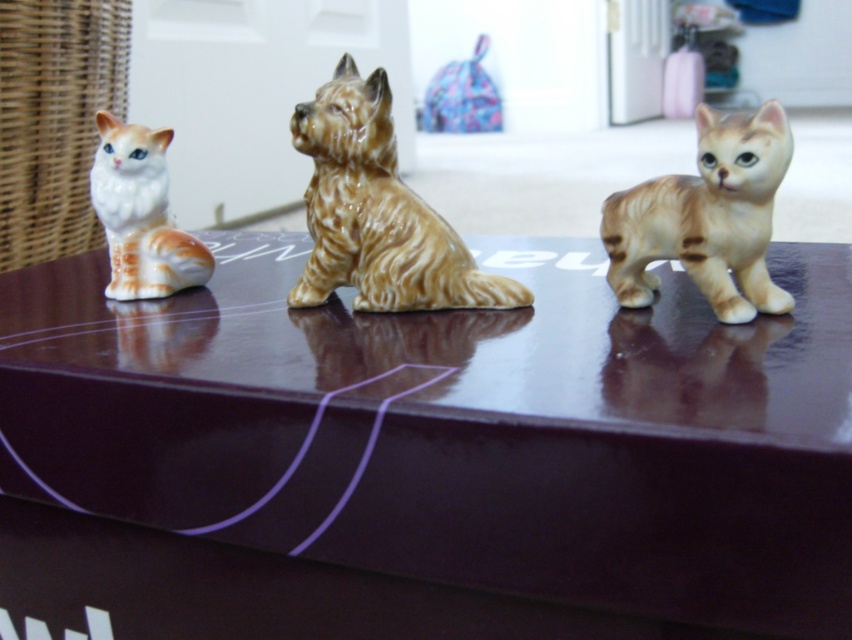
Between glossy brown table at center and brown glossy dog at center, which one has less height?

Standing shorter between the two is brown glossy dog at center.

Can you confirm if glossy brown table at center is positioned to the left of brown glossy dog at center?

In fact, glossy brown table at center is to the right of brown glossy dog at center.

I want to click on glossy brown table at center, so click(x=462, y=426).

Where is `glossy brown table at center`? This screenshot has width=852, height=640. glossy brown table at center is located at coordinates (462, 426).

Is point (770, 289) in front of point (119, 148)?

That is True.

Between matte orange cat at right and white glossy cat at left, which one has less height?

Standing shorter between the two is matte orange cat at right.

I want to click on matte orange cat at right, so click(x=706, y=218).

Where is `matte orange cat at right`? The height and width of the screenshot is (640, 852). matte orange cat at right is located at coordinates (706, 218).

Measure the distance between glossy brown table at center and white glossy cat at left.

glossy brown table at center and white glossy cat at left are 31.29 centimeters apart from each other.

At what (x,y) coordinates should I click in order to perform the action: click on glossy brown table at center. Please return your answer as a coordinate pair (x, y). The image size is (852, 640). Looking at the image, I should click on (462, 426).

I want to click on glossy brown table at center, so click(x=462, y=426).